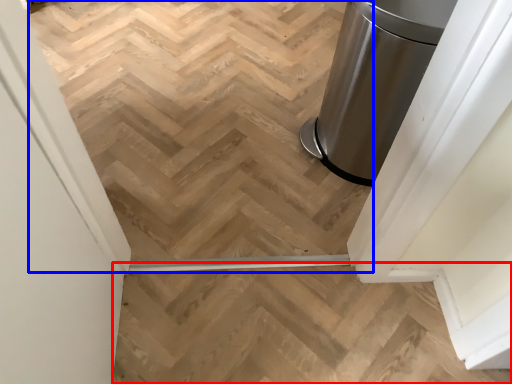
Question: Which point is closer to the camera, stairs (highlighted by a red box) or stairwell (highlighted by a blue box)?

Choices:
 (A) stairs
 (B) stairwell

Answer: (A)